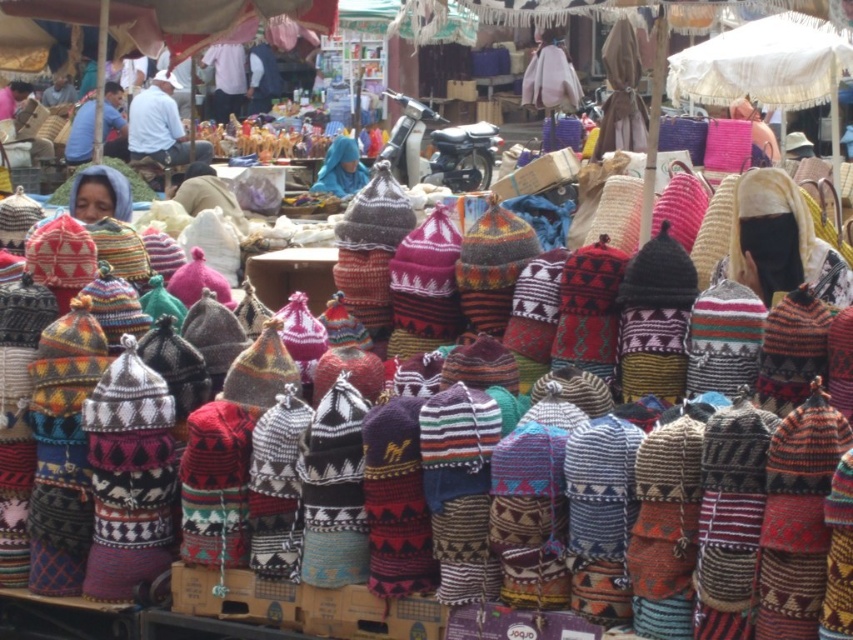
You are a customer in the market and want to pick up both the light blue cotton shirt at center and the blue knitted hat at center. Which item is closer to you?

The light blue cotton shirt at center is closer to you since it is only 12.82 meters away from the blue knitted hat at center.

You are a tailor who wants to create a matching outfit using the matte blue shirt at upper left and the blue knitted hat at center. Which item should you choose as the base for the outfit to ensure the proportions are balanced?

The matte blue shirt at upper left should be chosen as the base for the outfit since its width is larger than the blue knitted hat at center, ensuring better proportion balance.